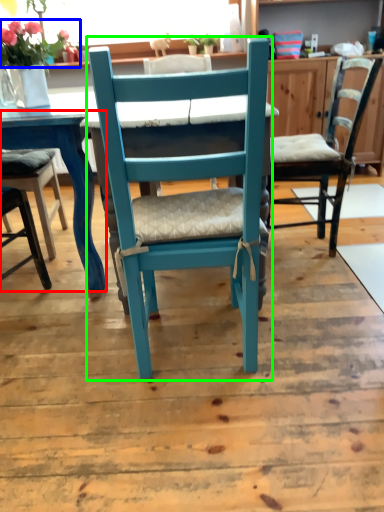
Question: Which is nearer to the table (highlighted by a red box)? flower (highlighted by a blue box) or chair (highlighted by a green box).

Choices:
 (A) flower
 (B) chair

Answer: (A)